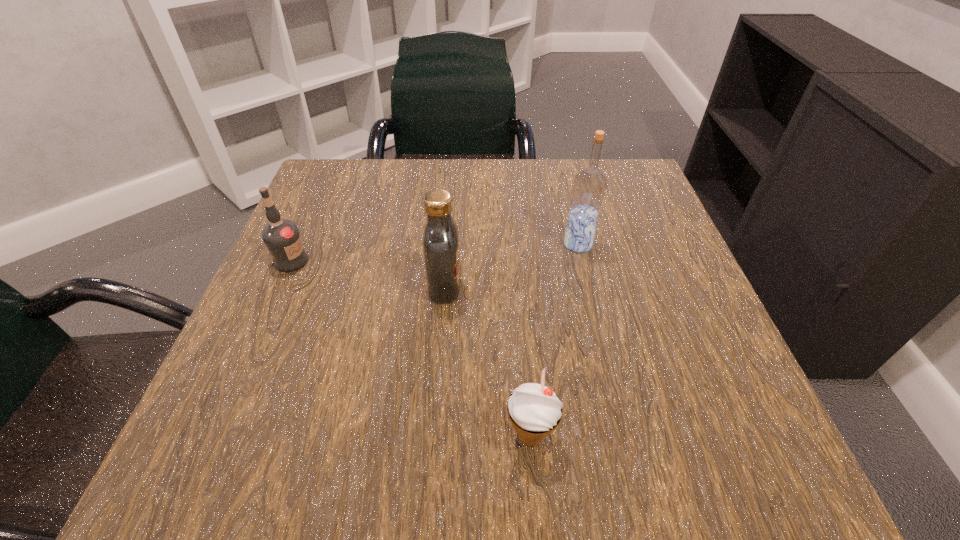
The height and width of the screenshot is (540, 960). In order to click on vacant space located on the front label of the leftmost object in this screenshot , I will do `click(479, 261)`.

Find the location of a particular element. This screenshot has height=540, width=960. free region located 0.180m on the right of the shortest object is located at coordinates (691, 436).

Where is `object that is at the near edge`? This screenshot has height=540, width=960. object that is at the near edge is located at coordinates (534, 407).

Find the location of a particular element. object located in the left edge section of the desktop is located at coordinates (282, 237).

Find the location of a particular element. object located at the right edge is located at coordinates (589, 186).

The height and width of the screenshot is (540, 960). In the image, there is a desktop. Find the location of `vacant space at the far edge`. vacant space at the far edge is located at coordinates (552, 164).

This screenshot has height=540, width=960. In the image, there is a desktop. Find the location of `vacant space at the left edge`. vacant space at the left edge is located at coordinates (324, 227).

The image size is (960, 540). Identify the location of free point at the right edge. (652, 269).

The width and height of the screenshot is (960, 540). Find the location of `free location at the far left corner of the desktop`. free location at the far left corner of the desktop is located at coordinates (309, 212).

This screenshot has height=540, width=960. In the image, there is a desktop. In order to click on vacant space at the far right corner in this screenshot , I will do `click(612, 171)`.